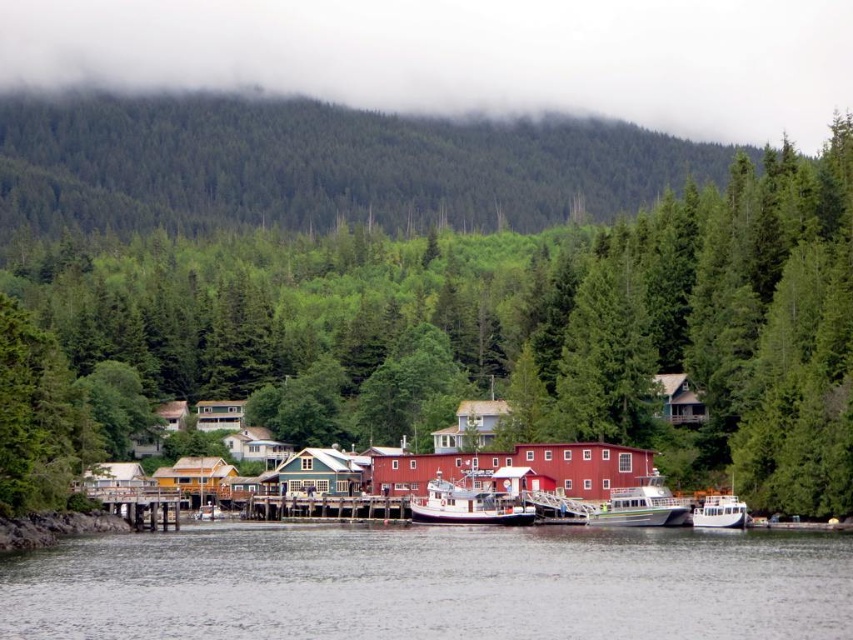
Does green textured tree at center appear on the left side of clear water at lower center?

In fact, green textured tree at center is to the right of clear water at lower center.

Measure the distance between point (819,364) and camera.

Point (819,364) is 344.26 feet away from camera.

Identify the location of green textured tree at center. (447, 282).

Which is behind, point (53, 602) or point (608, 504)?

Point (608, 504)

Can you confirm if clear water at lower center is shorter than white glossy boat at lower center?

In fact, clear water at lower center may be taller than white glossy boat at lower center.

Where is `clear water at lower center`? Image resolution: width=853 pixels, height=640 pixels. clear water at lower center is located at coordinates (431, 584).

This screenshot has width=853, height=640. Identify the location of clear water at lower center. (431, 584).

Is point (451, 515) less distant than point (741, 525)?

No, (451, 515) is behind (741, 525).

Locate an element on the screen. white wooden boat at center is located at coordinates (469, 506).